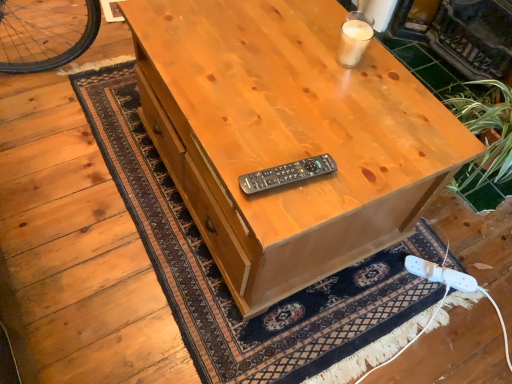
You are a GUI agent. You are given a task and a screenshot of the screen. Output one action in this format:
    pyautogui.click(x=<x>, y=<y>)
    Task: Click on the vacant area that lies in front of black plastic remote at center
    The image size is (512, 384).
    Given the screenshot: What is the action you would take?
    pyautogui.click(x=279, y=210)